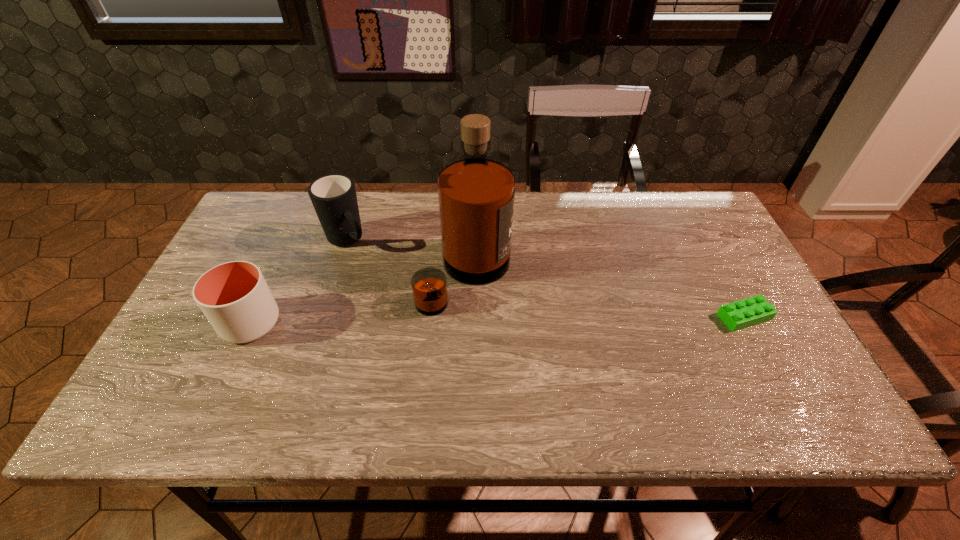
The width and height of the screenshot is (960, 540). I want to click on vacant space that satisfies the following two spatial constraints: 1. on the front side of the second tallest object; 2. on the right side of the second object from right to left, so click(337, 275).